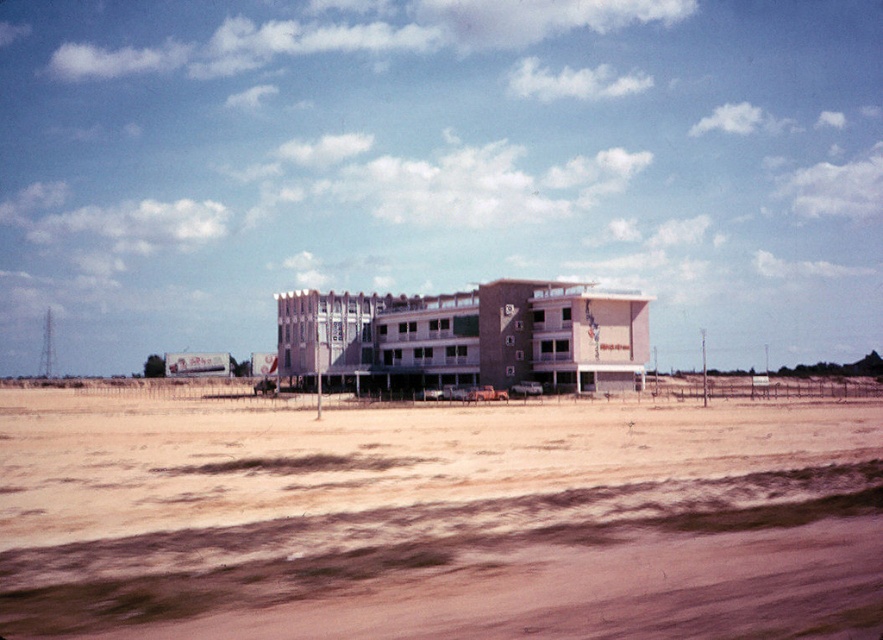
You are standing at the entrance of the large, multi story building in the desert. You notice a point marked at coordinates [436,518]. What is located at that point?

The point at [436,518] is occupied by a brown sandy dirt field at lower center.

You are standing at the entrance of the beige brick hotel at center and want to cross to the brown sandy dirt field at lower center. Which direction should you walk to reach the field?

The brown sandy dirt field at lower center is positioned on the right side of beige brick hotel at center, so you should walk to the right to reach the field.